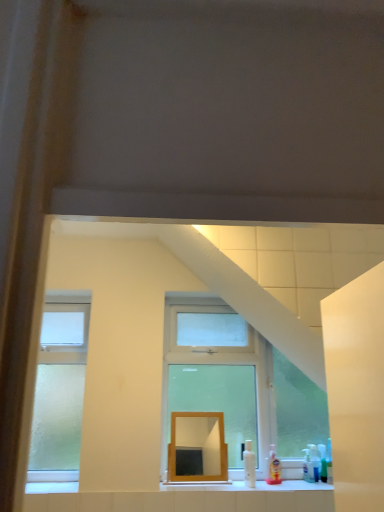
Locate an element on the screen. Image resolution: width=384 pixels, height=512 pixels. blank space situated above wooden mirror at center (from a real-world perspective) is located at coordinates (190, 415).